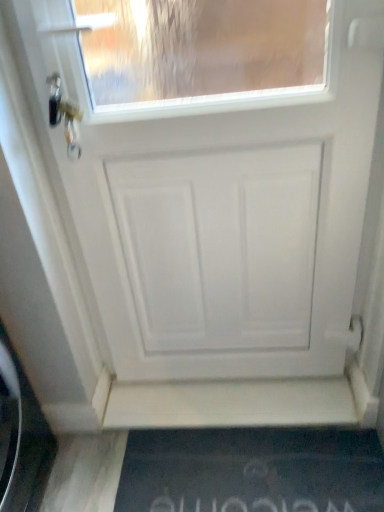
Question: Does black rubber doormat at lower center have a lesser width compared to white matte door at center?

Choices:
 (A) no
 (B) yes

Answer: (A)

Question: Is black rubber doormat at lower center positioned before white matte door at center?

Choices:
 (A) yes
 (B) no

Answer: (B)

Question: Does black rubber doormat at lower center have a lesser height compared to white matte door at center?

Choices:
 (A) no
 (B) yes

Answer: (B)

Question: Is there a large distance between black rubber doormat at lower center and white matte door at center?

Choices:
 (A) yes
 (B) no

Answer: (B)

Question: From a real-world perspective, is black rubber doormat at lower center physically above white matte door at center?

Choices:
 (A) no
 (B) yes

Answer: (A)

Question: Considering the relative positions of black rubber doormat at lower center and white matte door at center in the image provided, is black rubber doormat at lower center to the right of white matte door at center from the viewer's perspective?

Choices:
 (A) yes
 (B) no

Answer: (A)

Question: Considering the relative positions of white matte door at center and black rubber doormat at lower center in the image provided, is white matte door at center in front of black rubber doormat at lower center?

Choices:
 (A) yes
 (B) no

Answer: (A)

Question: Is white matte door at center surrounding black rubber doormat at lower center?

Choices:
 (A) no
 (B) yes

Answer: (A)

Question: From the image's perspective, would you say white matte door at center is shown under black rubber doormat at lower center?

Choices:
 (A) no
 (B) yes

Answer: (A)

Question: Is white matte door at center not within black rubber doormat at lower center?

Choices:
 (A) yes
 (B) no

Answer: (A)

Question: Does white matte door at center have a smaller size compared to black rubber doormat at lower center?

Choices:
 (A) no
 (B) yes

Answer: (A)

Question: From a real-world perspective, is white matte door at center physically below black rubber doormat at lower center?

Choices:
 (A) yes
 (B) no

Answer: (B)

Question: Is black rubber doormat at lower center inside the boundaries of white matte door at center, or outside?

Choices:
 (A) inside
 (B) outside

Answer: (B)